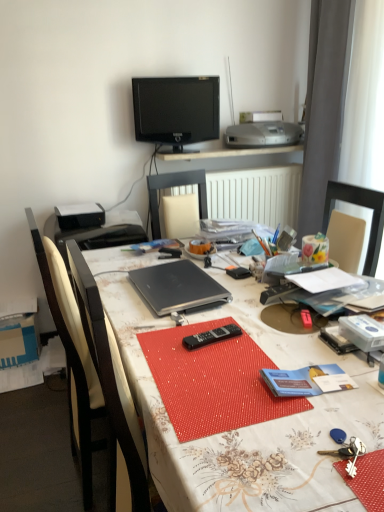
Find the location of a particular element. This screenshot has height=512, width=384. vacant space behind black plastic remote at center is located at coordinates (218, 314).